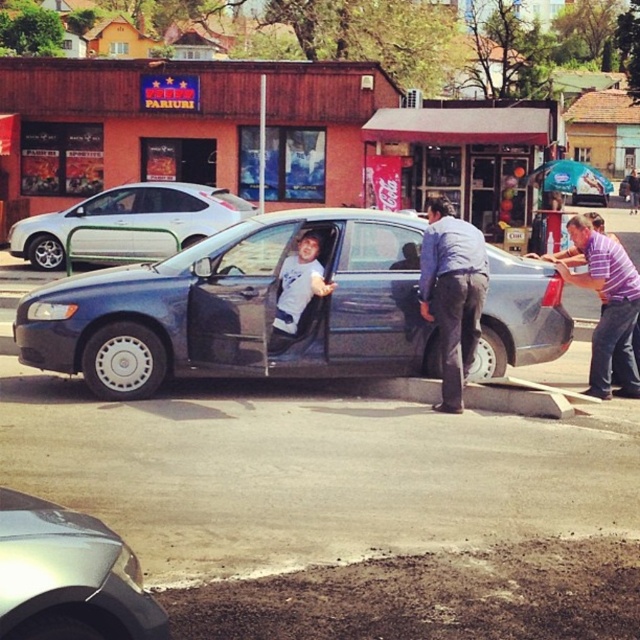
From the picture: You are a pedestrian standing on the sidewalk. You see the white matte sedan at center and the purple striped shirt at right. Which object is closer to the ground?

The purple striped shirt at right is closer to the ground because the white matte sedan at center is located above it.

You are a delivery driver who needs to park your metallic blue sedan at center in a specific spot. The parking spot is marked at coordinates point A which is at point A at coordinates point A at coordinates point A at coordinates point A at coordinates point A at coordinates point A at coordinates point A at coordinates point A at coordinates point A at coordinates point A at coordinates point A at coordinates point A at coordinates point A at coordinates point A at coordinates point A at coordinates point

The metallic blue sedan at center is located at point (x=240, y=308), so you need to move it to the parking spot at point A to park correctly.

You are a pedestrian standing on the sidewalk and see the metallic blue sedan at center and the blue fabric shirt at center. Which object is located to the left?

The metallic blue sedan at center is positioned on the left side of blue fabric shirt at center, so the metallic blue sedan at center is to the left.